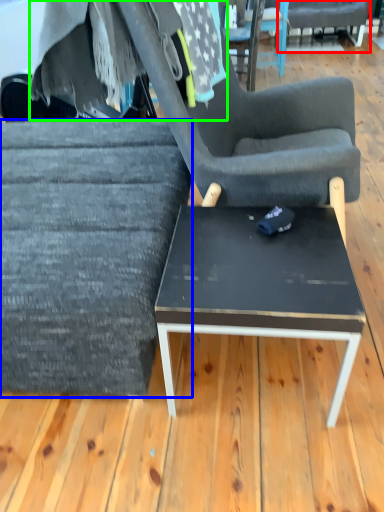
Question: Which object is the closest to the chair (highlighted by a red box)? Choose among these: chair (highlighted by a blue box) or fabric (highlighted by a green box).

Choices:
 (A) chair
 (B) fabric

Answer: (B)